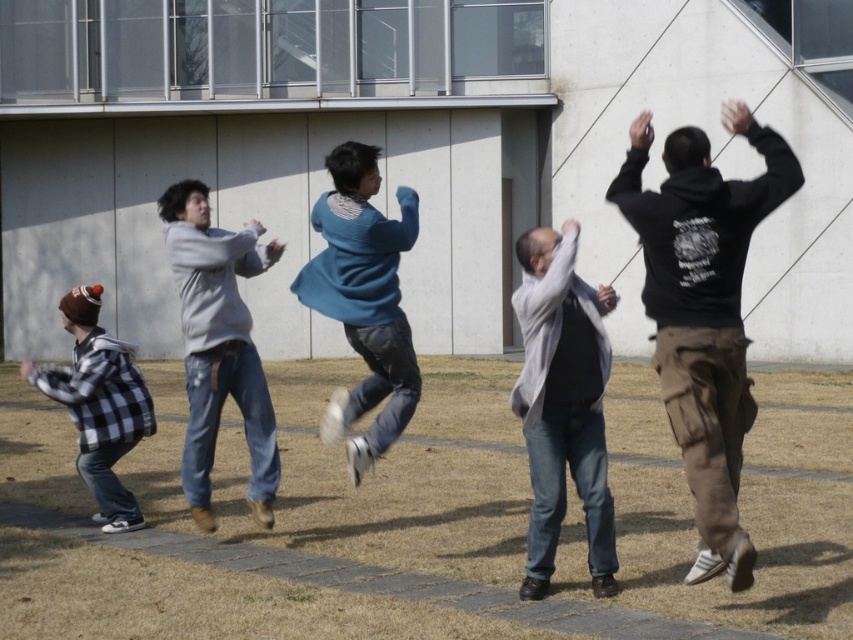
Question: In this image, where is black matte hoodie at right located relative to gray cotton shirt at center?

Choices:
 (A) below
 (B) above

Answer: (B)

Question: Does matte gray hoodie at center come in front of checkered fabric jacket at lower left?

Choices:
 (A) no
 (B) yes

Answer: (B)

Question: Which point is closer to the camera taking this photo?

Choices:
 (A) (590, 449)
 (B) (194, 256)

Answer: (A)

Question: Which point is closer to the camera taking this photo?

Choices:
 (A) (401, 342)
 (B) (720, 198)
 (C) (552, 436)
 (D) (90, 472)

Answer: (B)

Question: Can you confirm if black matte hoodie at right is smaller than checkered fabric jacket at lower left?

Choices:
 (A) yes
 (B) no

Answer: (B)

Question: Which object is the closest to the matte gray hoodie at center?

Choices:
 (A) black matte hoodie at right
 (B) gray cotton shirt at center

Answer: (B)